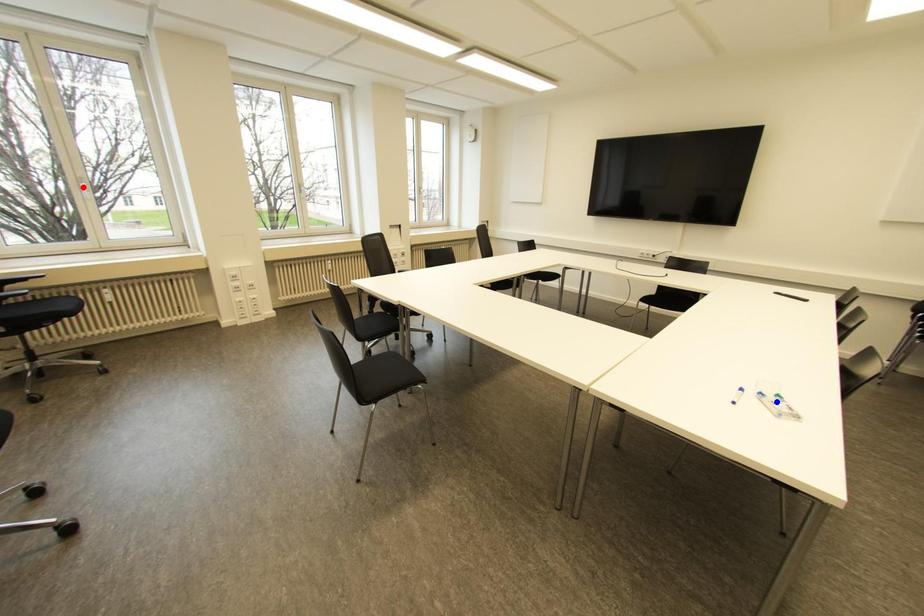
Question: Which of the two points in the image is closer to the camera?

Choices:
 (A) Blue point is closer.
 (B) Red point is closer.

Answer: (A)